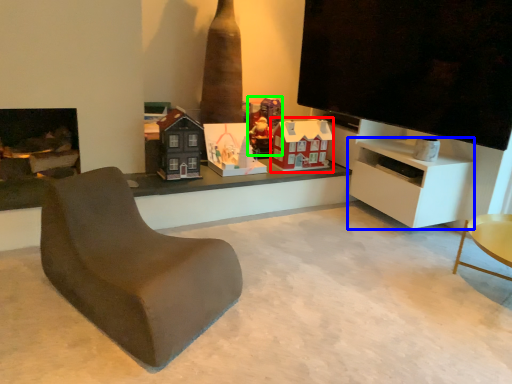
Question: Which object is the closest to the toy (highlighted by a red box)? Choose among these: cabinetry (highlighted by a blue box) or toy (highlighted by a green box).

Choices:
 (A) cabinetry
 (B) toy

Answer: (B)